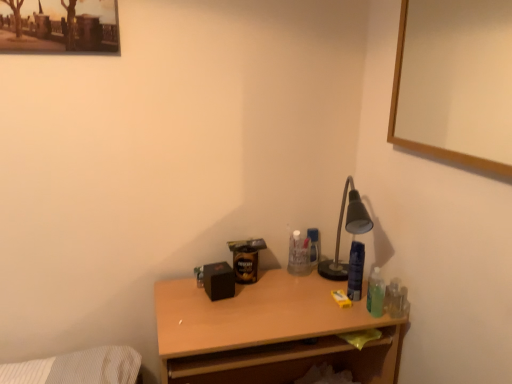
Image resolution: width=512 pixels, height=384 pixels. I want to click on vacant region above wooden desk at center (from a real-world perspective), so click(271, 299).